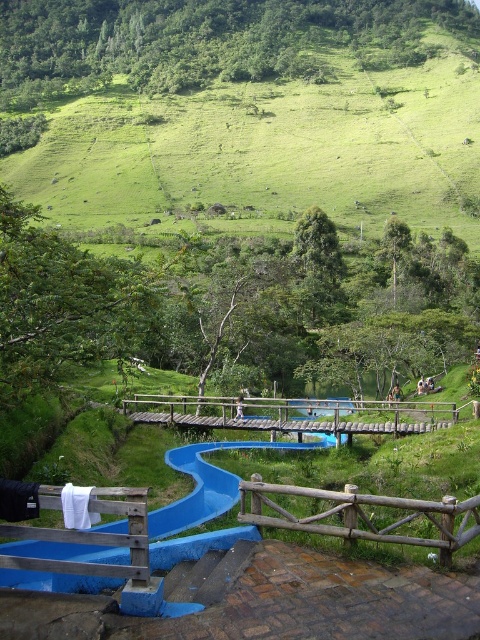
In the scene shown: Which is more to the right, blue plastic slide at center or wooden bridge at center?

wooden bridge at center is more to the right.

Does blue plastic slide at center have a greater height compared to wooden bridge at center?

Indeed, blue plastic slide at center has a greater height compared to wooden bridge at center.

At what (x,y) coordinates should I click in order to perform the action: click on blue plastic slide at center. Please return your answer as a coordinate pair (x, y). The image size is (480, 640). Looking at the image, I should click on (204, 502).

Does wooden bridge at center have a smaller size compared to brown wooden fence at lower center?

Actually, wooden bridge at center might be larger than brown wooden fence at lower center.

Image resolution: width=480 pixels, height=640 pixels. I want to click on wooden bridge at center, so click(291, 413).

Is point (411, 404) positioned after point (439, 513)?

Yes, it is.

Where is `wooden bridge at center`? The width and height of the screenshot is (480, 640). wooden bridge at center is located at coordinates (291, 413).

Is blue plastic slide at center positioned in front of brown wooden fence at lower center?

Yes, blue plastic slide at center is closer to the viewer.

Does point (90, 554) come farther from viewer compared to point (363, 532)?

Yes, point (90, 554) is farther from viewer.

Which is in front, point (201, 536) or point (315, 490)?

Positioned in front is point (315, 490).

You are a GUI agent. You are given a task and a screenshot of the screen. Output one action in this format:
    pyautogui.click(x=<x>, y=<y>)
    Task: Click on the blue plastic slide at center
    The width and height of the screenshot is (480, 640).
    Given the screenshot: What is the action you would take?
    pyautogui.click(x=204, y=502)